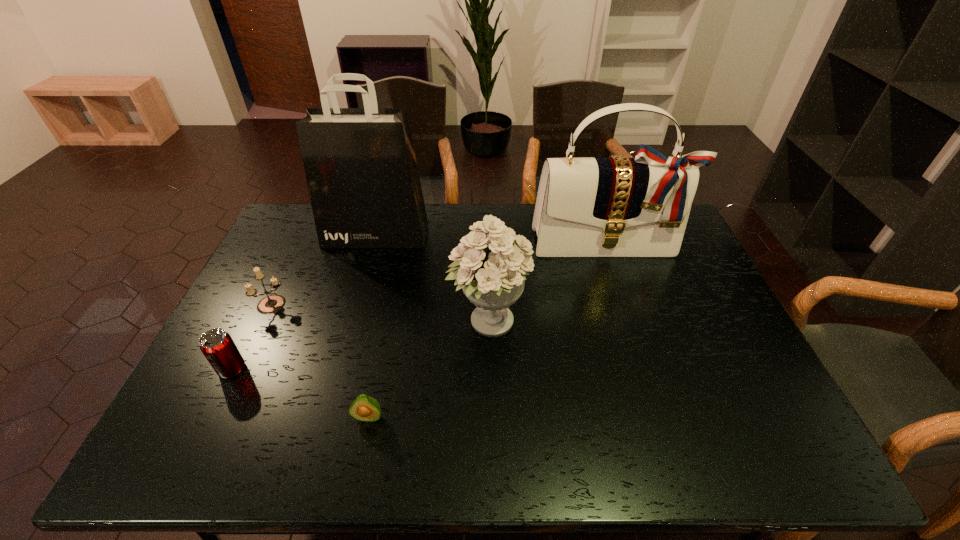
The height and width of the screenshot is (540, 960). In order to click on free space located on the back of the soda can in this screenshot , I will do `click(263, 306)`.

Find the location of `free space located on the right of the candle holder`. free space located on the right of the candle holder is located at coordinates (356, 304).

This screenshot has width=960, height=540. Find the location of `shopping bag that is at the far edge`. shopping bag that is at the far edge is located at coordinates (360, 165).

Locate an element on the screen. The height and width of the screenshot is (540, 960). satchel at the far edge is located at coordinates (618, 206).

Image resolution: width=960 pixels, height=540 pixels. Find the location of `soda can that is at the left edge`. soda can that is at the left edge is located at coordinates (218, 347).

You are a GUI agent. You are given a task and a screenshot of the screen. Output one action in this format:
    pyautogui.click(x=<x>, y=<y>)
    Task: Click on the candle holder situated at the left edge
    This screenshot has height=540, width=960.
    Given the screenshot: What is the action you would take?
    pyautogui.click(x=271, y=304)

The width and height of the screenshot is (960, 540). I want to click on object present at the right edge, so [618, 206].

Where is `object at the far right corner`? This screenshot has height=540, width=960. object at the far right corner is located at coordinates (618, 206).

In the image, there is a desktop. Where is `blank space at the near edge`? This screenshot has height=540, width=960. blank space at the near edge is located at coordinates (534, 441).

Where is `free space at the left edge of the desktop`? free space at the left edge of the desktop is located at coordinates (x=176, y=421).